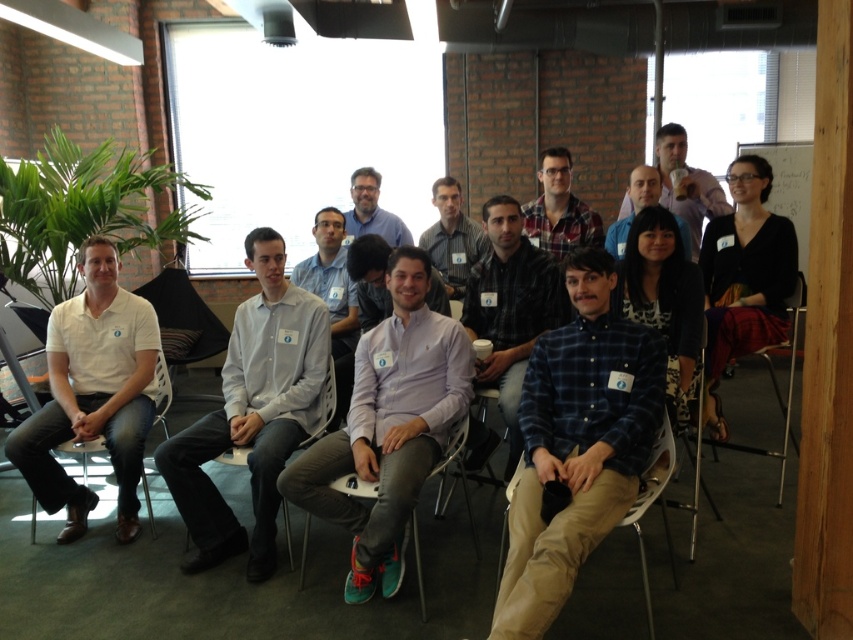
Can you confirm if black matte shirt at upper right is positioned to the right of light gray shirt at center?

Correct, you'll find black matte shirt at upper right to the right of light gray shirt at center.

Between point (744, 209) and point (456, 202), which one is positioned behind?

Positioned behind is point (456, 202).

Is point (780, 259) closer to viewer compared to point (453, 292)?

Yes, point (780, 259) is closer to viewer.

The width and height of the screenshot is (853, 640). I want to click on black matte shirt at upper right, so click(744, 278).

Between white shirt at center and white plastic chair at center, which one is positioned higher?

white shirt at center is above.

Between point (337, 355) and point (299, 570), which one is positioned in front?

Point (299, 570) is in front.

This screenshot has width=853, height=640. Find the location of `white shirt at center`. white shirt at center is located at coordinates (334, 298).

Can you confirm if black matte shirt at upper right is smaller than metallic silver chair at lower right?

Correct, black matte shirt at upper right occupies less space than metallic silver chair at lower right.

Based on the photo, does black matte shirt at upper right have a lesser width compared to metallic silver chair at lower right?

Yes.

Which is in front, point (715, 301) or point (757, 451)?

Positioned in front is point (757, 451).

Locate an element on the screen. The width and height of the screenshot is (853, 640). black matte shirt at upper right is located at coordinates (744, 278).